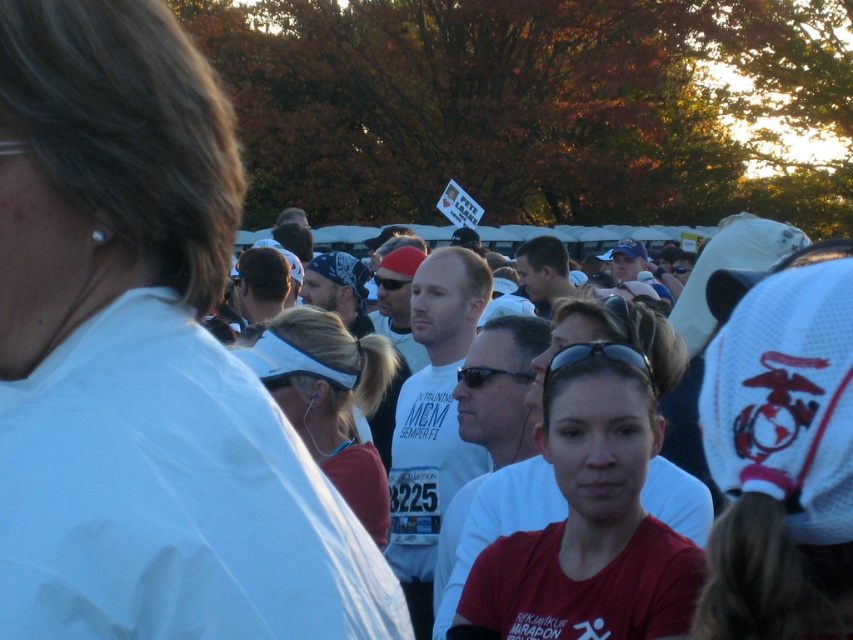
You are a photographer at the event and need to capture a group photo. The white matte shirt at upper left and the matte red shirt at center are in your frame. Which shirt should you focus on if you want to ensure the thinner one is in sharp focus?

You should focus on the white matte shirt at upper left because it is thinner than the matte red shirt at center.

You are standing at the entrance of the event and want to find the person wearing the matte red shirt at center. According to the coordinates given, in which direction should you look relative to your current position?

The matte red shirt at center is located at coordinates point (589, 525), which means you should look towards the lower right direction from your current position at the entrance.